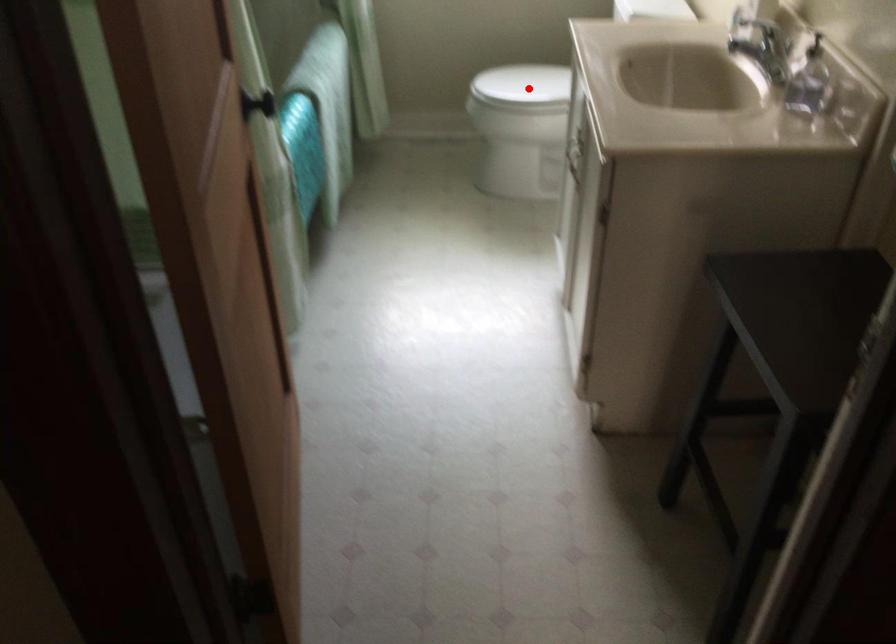
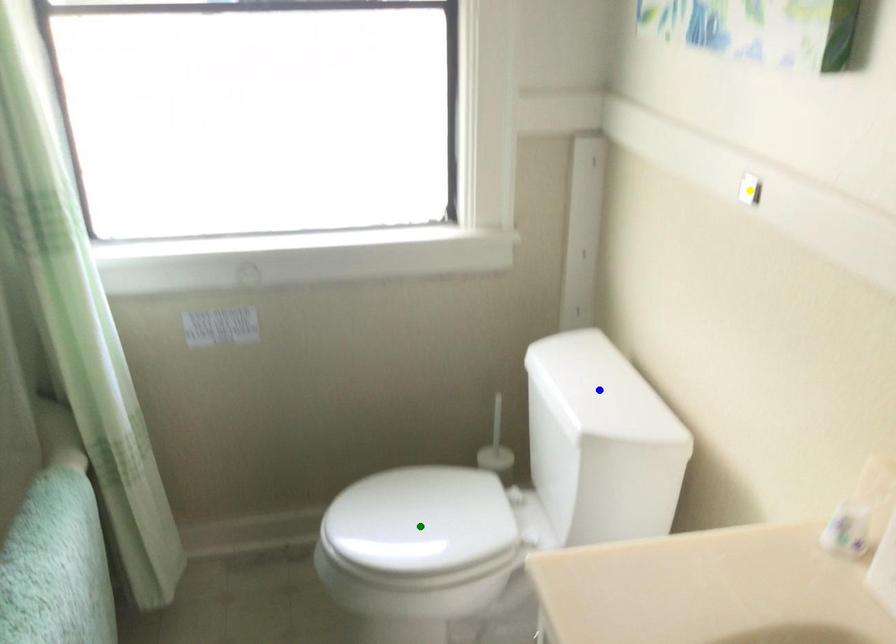
Question: I am providing you with two images of the same scene from different viewpoints. A red point is marked on the first image. You are given multiple points on the second image. Can you choose the point in image 2 that corresponds to the point in image 1?

Choices:
 (A) blue point
 (B) yellow point
 (C) green point

Answer: (C)